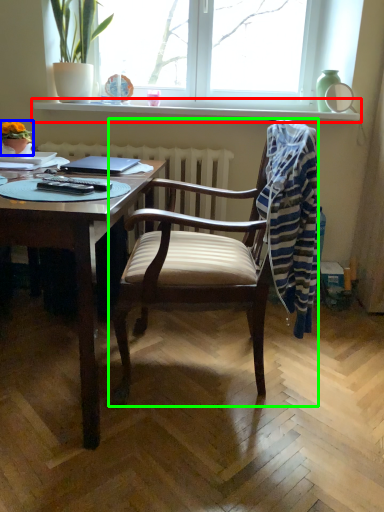
Question: Estimate the real-world distances between objects in this image. Which object is closer to window sill (highlighted by a red box), houseplant (highlighted by a blue box) or chair (highlighted by a green box)?

Choices:
 (A) houseplant
 (B) chair

Answer: (A)